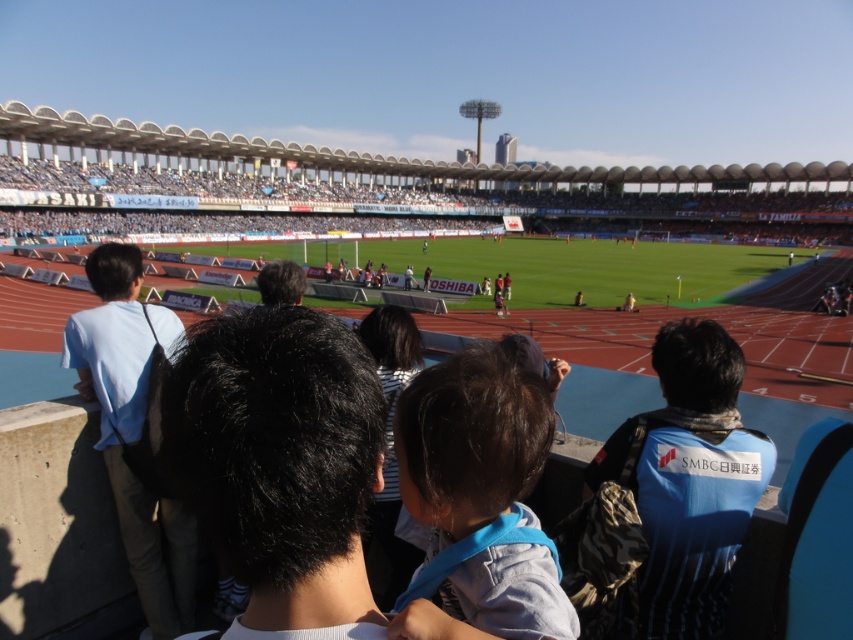
Can you confirm if blue fabric jacket at lower right is thinner than light blue shirt at left?

Indeed, blue fabric jacket at lower right has a lesser width compared to light blue shirt at left.

Does point (718, 484) lie behind point (100, 259)?

That is False.

Where is `blue fabric jacket at lower right`? blue fabric jacket at lower right is located at coordinates (689, 480).

Is blue denim shirt at center to the right of light blue shirt at left from the viewer's perspective?

Correct, you'll find blue denim shirt at center to the right of light blue shirt at left.

This screenshot has width=853, height=640. I want to click on blue denim shirt at center, so click(477, 500).

Who is more forward, (407,394) or (144,388)?

Point (407,394) is more forward.

This screenshot has width=853, height=640. I want to click on blue denim shirt at center, so click(x=477, y=500).

Who is shorter, blue denim shirt at center or blue fabric jacket at lower right?

blue denim shirt at center

Between blue denim shirt at center and blue fabric jacket at lower right, which one is positioned higher?

blue denim shirt at center is above.

Does point (502, 481) lie in front of point (671, 420)?

Yes, point (502, 481) is closer to viewer.

This screenshot has width=853, height=640. Find the location of `blue denim shirt at center`. blue denim shirt at center is located at coordinates (477, 500).